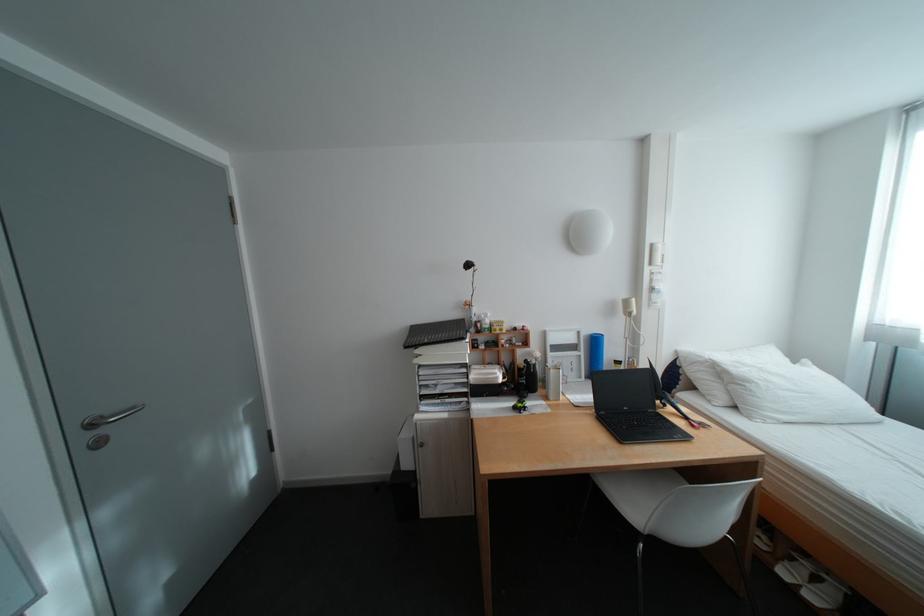
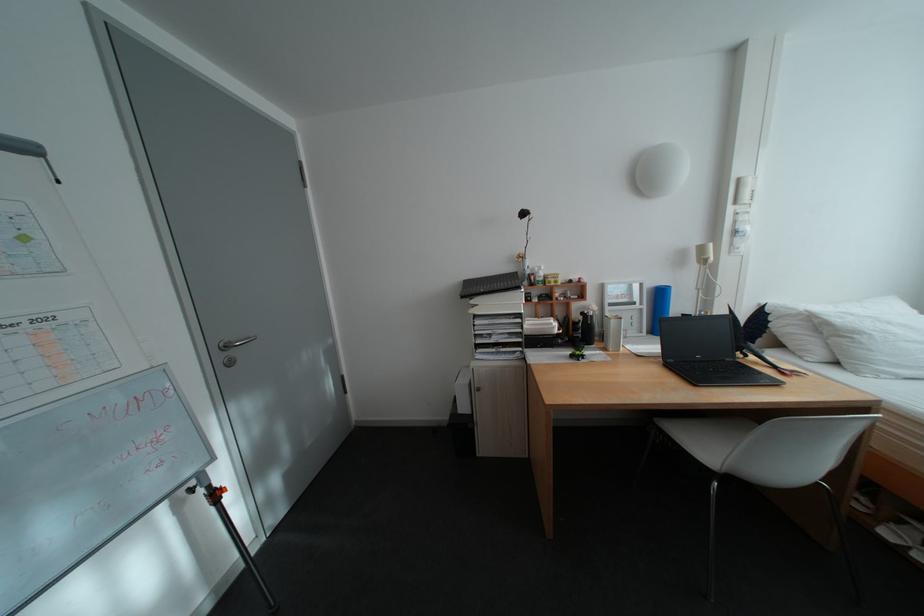
In the second image, find the point that corresponds to (558,399) in the first image.

(617, 350)